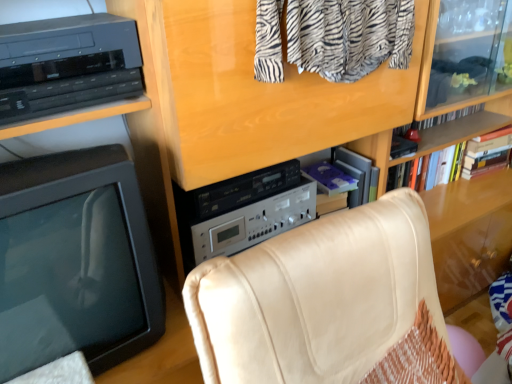
Question: From the image's perspective, is purple matte book at center, the first book when ordered from left to right, above or below black plastic shelf at upper left?

Choices:
 (A) below
 (B) above

Answer: (A)

Question: In terms of width, does purple matte book at center, which is the third book from right to left, look wider or thinner when compared to black plastic shelf at upper left?

Choices:
 (A) wide
 (B) thin

Answer: (B)

Question: Based on their relative distances, which object is farther from the black plastic shelf at upper left?

Choices:
 (A) beige leather chair at center
 (B) hardcover book at upper right, arranged as the 3th book when viewed from the left
 (C) purple plastic book at center right, which is the 2th book from left to right
 (D) silver metallic amplifier at center
 (E) purple matte book at center, which is the third book from right to left

Answer: (B)

Question: Based on their relative distances, which object is nearer to the beige leather chair at center?

Choices:
 (A) purple matte book at center, the first book when ordered from left to right
 (B) black plastic television at left
 (C) purple plastic book at center right, the second book in the right-to-left sequence
 (D) hardcover book at upper right, positioned as the first book in right-to-left order
 (E) silver metallic amplifier at center

Answer: (B)